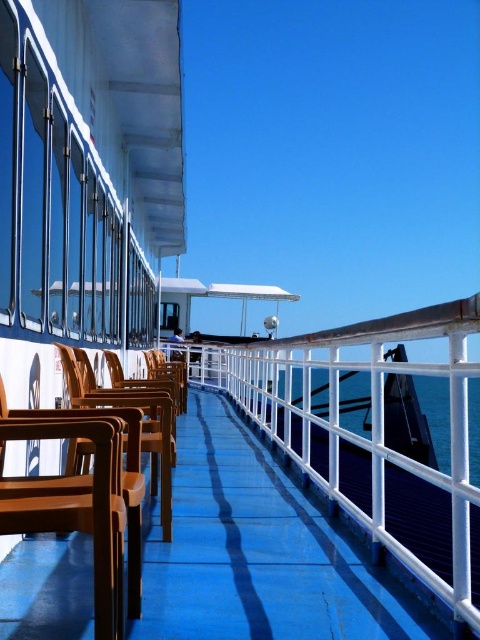
Question: Does brown wood chairs at left have a greater width compared to transparent blue water at center?

Choices:
 (A) yes
 (B) no

Answer: (B)

Question: Which point is farther to the camera?

Choices:
 (A) (468, 416)
 (B) (197, 563)

Answer: (A)

Question: Does brown wood chairs at left appear on the right side of transparent blue water at center?

Choices:
 (A) yes
 (B) no

Answer: (B)

Question: Can you confirm if brown wood chairs at left is positioned below transparent blue water at center?

Choices:
 (A) yes
 (B) no

Answer: (B)

Question: Which object appears closest to the camera in this image?

Choices:
 (A) transparent blue water at center
 (B) brown wood chairs at left

Answer: (B)

Question: Which of the following is the farthest from the observer?

Choices:
 (A) (474, 461)
 (B) (241, 456)

Answer: (A)